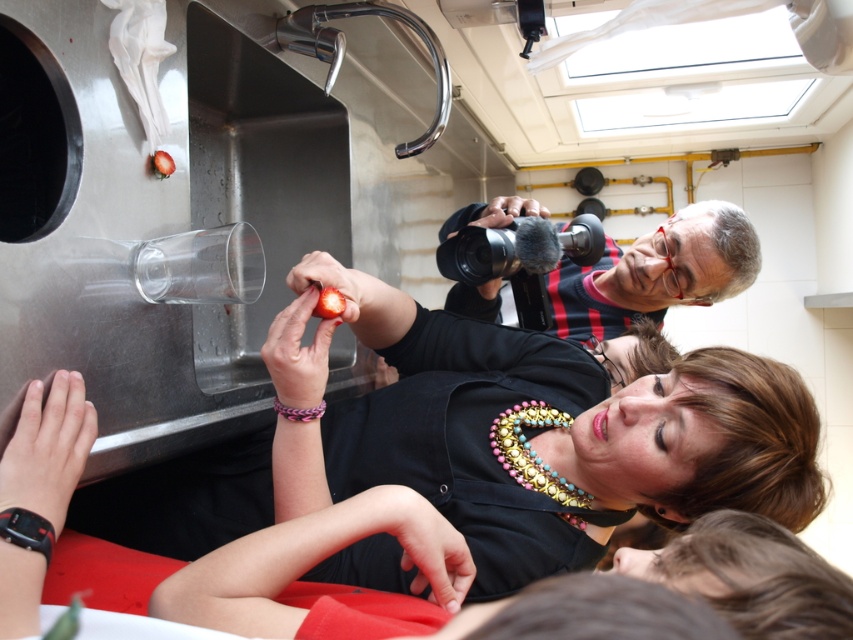
You are trying to take a photo of the person holding the strawberry without including the camera operator in the frame. Given the positions of the matte black shirt at center and the matte black camera at upper right, which direction should you move to ensure the camera operator isn

Since the matte black shirt at center is to the left of the matte black camera at upper right, you should move to the right to exclude the camera operator holding the matte black camera at upper right from your photo.

You are a jeweler examining two bracelets in the image. The black rubber bracelet at lower left and the pink woven bracelet at center. Which bracelet is located to the left of the other?

The black rubber bracelet at lower left is positioned on the left side of the pink woven bracelet at center.

You are a photographer trying to frame a shot of the two people in the scene. You need to ensure that the matte black shirt at center and the matte black camera at upper right are both visible in the frame. Based on their sizes, which object should you prioritize keeping within the frame to avoid cropping?

The matte black shirt at center is taller than the matte black camera at upper right, so you should prioritize keeping the matte black shirt at center in the frame to avoid cropping since it is larger in size.